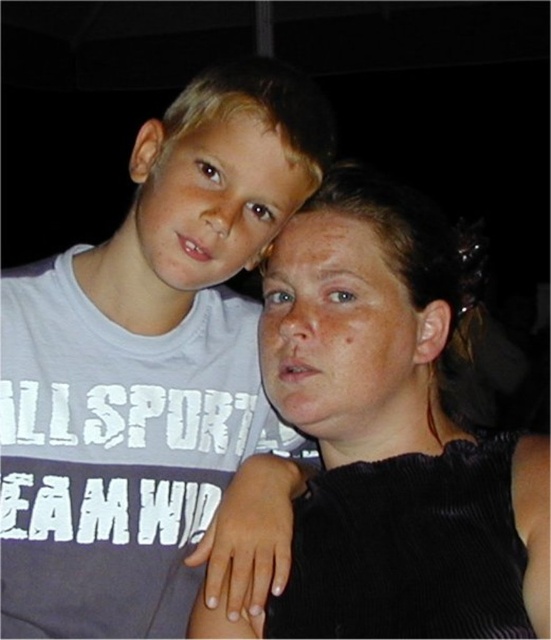
You are taking a photo of two people in a dark room. You notice two points of light in the image, one at coordinates point (300, 614) and another at point (153, 172). Which point is closer to the camera?

Point (300, 614) is closer to the camera than point (153, 172).